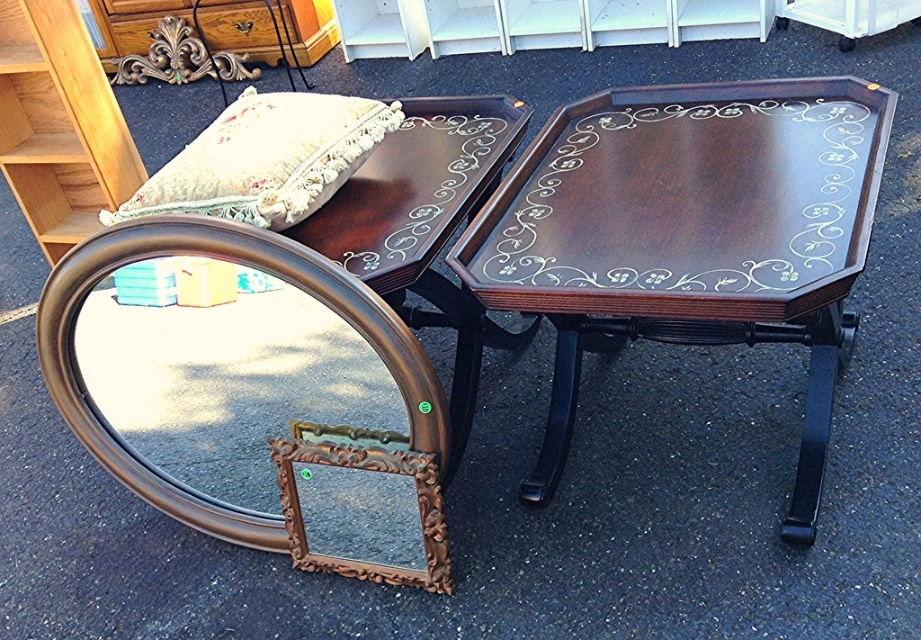
Question: Which point is farther to the camera?

Choices:
 (A) gold ornate mirror at center
 (B) velvet floral pillow at upper left
 (C) light brown wood bookshelf at upper left

Answer: (C)

Question: Is gold ornate mirror at center thinner than light brown wood bookshelf at upper left?

Choices:
 (A) yes
 (B) no

Answer: (B)

Question: Is dark wood/inlaid table at center positioned before gold ornate mirror at center?

Choices:
 (A) no
 (B) yes

Answer: (B)

Question: Is gold ornate mirror at center positioned in front of velvet floral pillow at upper left?

Choices:
 (A) yes
 (B) no

Answer: (A)

Question: Which point appears farthest from the camera in this image?

Choices:
 (A) (148, 26)
 (B) (202, 184)
 (C) (309, 273)

Answer: (A)

Question: Which object appears closest to the camera in this image?

Choices:
 (A) gold ornate mirror at center
 (B) dark wood/inlaid table at center
 (C) velvet floral pillow at upper left

Answer: (B)